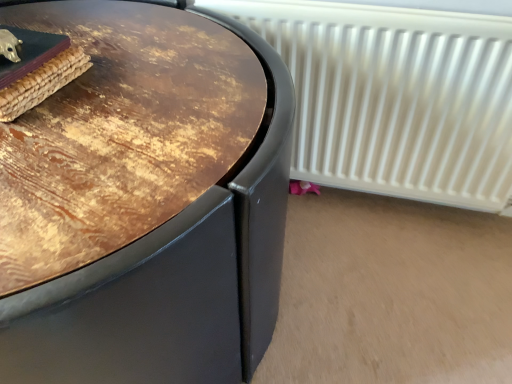
Identify the location of white matte radiator at upper right. (395, 97).

Describe the element at coordinates (395, 97) in the screenshot. I see `white matte radiator at upper right` at that location.

This screenshot has width=512, height=384. Identify the location of white matte radiator at upper right. (395, 97).